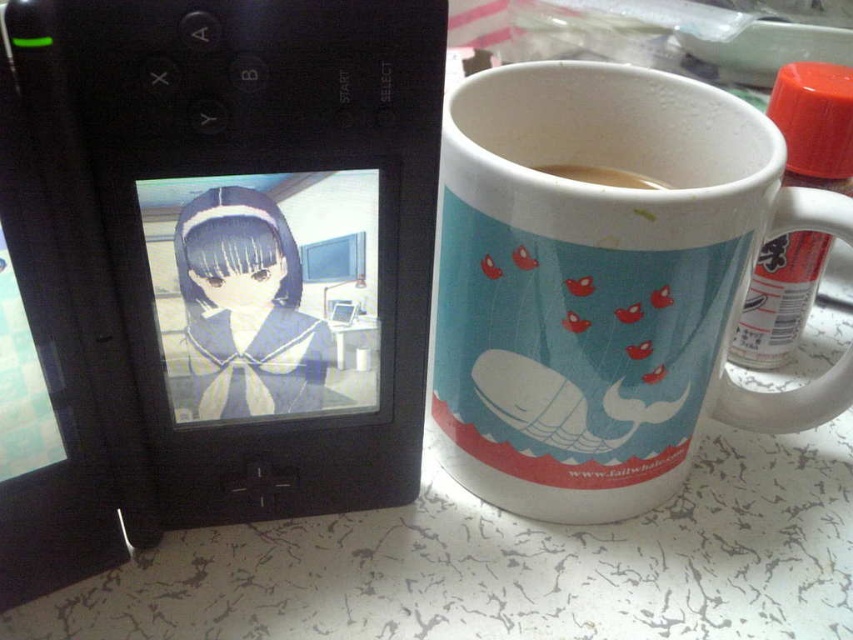
Is matte black anime girl at left to the right of brown matte coffee at upper right from the viewer's perspective?

Incorrect, matte black anime girl at left is not on the right side of brown matte coffee at upper right.

Does matte black anime girl at left appear over brown matte coffee at upper right?

Actually, matte black anime girl at left is below brown matte coffee at upper right.

Who is more distant from viewer, (241, 337) or (566, 164)?

The point (566, 164) is behind.

Identify the location of matte black anime girl at left. This screenshot has height=640, width=853. (247, 308).

What do you see at coordinates (602, 284) in the screenshot? I see `white ceramic mug at right` at bounding box center [602, 284].

Is white ceramic mug at right to the left of brown matte coffee at upper right from the viewer's perspective?

Incorrect, white ceramic mug at right is not on the left side of brown matte coffee at upper right.

Is point (682, 390) behind point (614, 182)?

No.

Locate an element on the screen. Image resolution: width=853 pixels, height=640 pixels. white ceramic mug at right is located at coordinates (602, 284).

Is white ceramic mug at right below matte black anime girl at left?

No, white ceramic mug at right is not below matte black anime girl at left.

Measure the distance between white ceramic mug at right and camera.

white ceramic mug at right is 69.14 centimeters away from camera.

At what (x,y) coordinates should I click in order to perform the action: click on white ceramic mug at right. Please return your answer as a coordinate pair (x, y). The height and width of the screenshot is (640, 853). Looking at the image, I should click on (602, 284).

At what (x,y) coordinates should I click in order to perform the action: click on white ceramic mug at right. Please return your answer as a coordinate pair (x, y). The width and height of the screenshot is (853, 640). Looking at the image, I should click on 602,284.